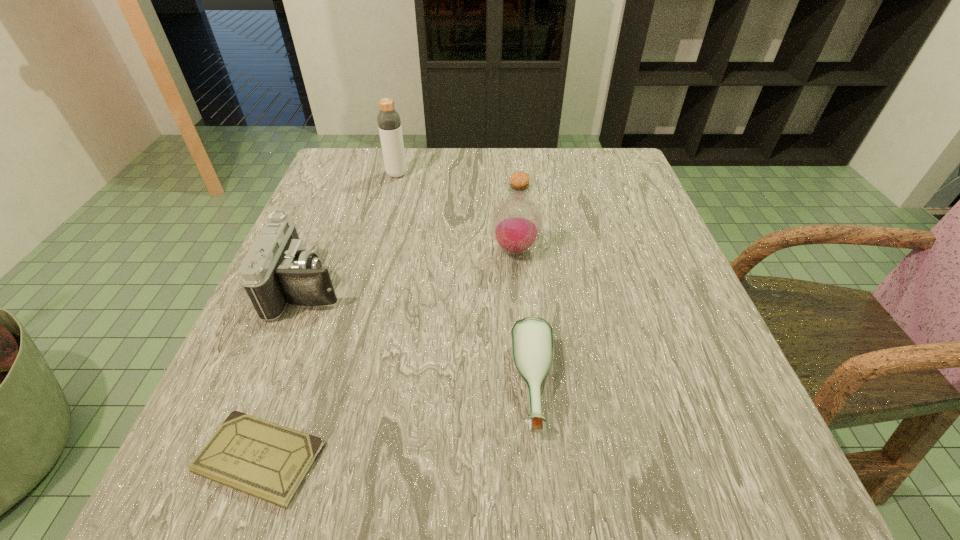
The width and height of the screenshot is (960, 540). In order to click on the farthest object in this screenshot , I will do `click(389, 123)`.

Where is `the farthest bottle`? the farthest bottle is located at coordinates (389, 123).

This screenshot has height=540, width=960. What are the coordinates of `the second nearest bottle` in the screenshot? It's located at (516, 225).

Image resolution: width=960 pixels, height=540 pixels. Find the location of `the third tallest object`. the third tallest object is located at coordinates (278, 270).

You are a GUI agent. You are given a task and a screenshot of the screen. Output one action in this format:
    pyautogui.click(x=<x>, y=<y>)
    Task: Click on the shortest bottle
    
    Given the screenshot: What is the action you would take?
    pyautogui.click(x=531, y=338)

This screenshot has width=960, height=540. I want to click on the second shortest object, so click(531, 338).

Locate an element on the screen. The width and height of the screenshot is (960, 540). checkbook is located at coordinates (268, 461).

Locate an element on the screen. The image size is (960, 540). free region located 0.290m on the front of the farthest bottle is located at coordinates (374, 260).

Find the location of `free location located on the back of the second farthest bottle`. free location located on the back of the second farthest bottle is located at coordinates (507, 155).

Find the location of a particular element. free space located at the front of the third shortest object with an open lens cover is located at coordinates (372, 287).